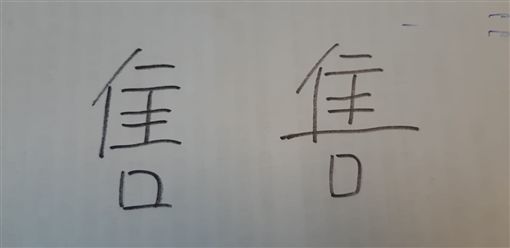
Locate an element on the screen. whiteboard is located at coordinates (240, 44).